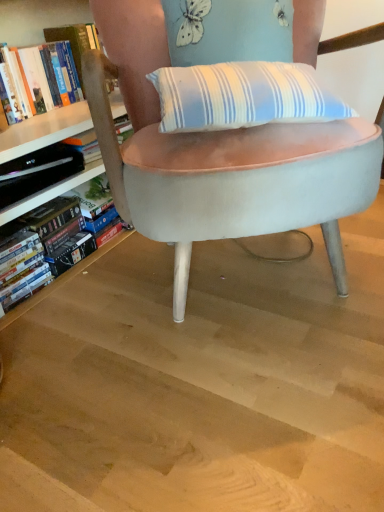
Question: Would you consider hardcover book at left, the 2th book from the top, to be distant from hardcover book at left, which appears as the 2th book when ordered from the bottom?

Choices:
 (A) no
 (B) yes

Answer: (A)

Question: Is hardcover book at left, the 2th book from the top, at the left side of hardcover book at left, which appears as the 2th book when ordered from the bottom?

Choices:
 (A) no
 (B) yes

Answer: (A)

Question: Is hardcover book at left, the 1th book positioned from the bottom, positioned with its back to hardcover book at left, which is the 1th book in top-to-bottom order?

Choices:
 (A) yes
 (B) no

Answer: (B)

Question: Is hardcover book at left, the 1th book positioned from the bottom, to the right of hardcover book at left, which appears as the 2th book when ordered from the bottom, from the viewer's perspective?

Choices:
 (A) yes
 (B) no

Answer: (A)

Question: Could you tell me if hardcover book at left, the 2th book from the top, is facing hardcover book at left, which appears as the 2th book when ordered from the bottom?

Choices:
 (A) no
 (B) yes

Answer: (A)

Question: Considering the positions of point (72, 208) and point (286, 300), is point (72, 208) closer or farther from the camera than point (286, 300)?

Choices:
 (A) farther
 (B) closer

Answer: (A)

Question: Considering their positions, is hardcover book at left, the 2th book from the top, located in front of or behind light brown wood at center?

Choices:
 (A) front
 (B) behind

Answer: (B)

Question: Based on their positions, is hardcover book at left, the 2th book from the top, located to the left or right of light brown wood at center?

Choices:
 (A) left
 (B) right

Answer: (A)

Question: Looking at their shapes, would you say hardcover book at left, the 2th book from the top, is wider or thinner than light brown wood at center?

Choices:
 (A) wide
 (B) thin

Answer: (B)

Question: Is point [x=61, y=53] positioned closer to the camera than point [x=11, y=172]?

Choices:
 (A) closer
 (B) farther

Answer: (B)

Question: From their relative heights in the image, would you say hardcover book at left, which is the 1th book in top-to-bottom order, is taller or shorter than hardcover book at left?

Choices:
 (A) tall
 (B) short

Answer: (A)

Question: From a real-world perspective, relative to hardcover book at left, is hardcover book at left, which appears as the 2th book when ordered from the bottom, vertically above or below?

Choices:
 (A) below
 (B) above

Answer: (B)

Question: Considering their positions, is hardcover book at left, which is the 1th book in top-to-bottom order, located in front of or behind hardcover book at left?

Choices:
 (A) behind
 (B) front

Answer: (A)

Question: From a real-world perspective, is hardcover book at left physically located above or below hardcover book at left, the 1th book positioned from the bottom?

Choices:
 (A) above
 (B) below

Answer: (A)

Question: Considering the positions of hardcover book at left and hardcover book at left, the 2th book from the top, in the image, is hardcover book at left bigger or smaller than hardcover book at left, the 2th book from the top,?

Choices:
 (A) big
 (B) small

Answer: (B)